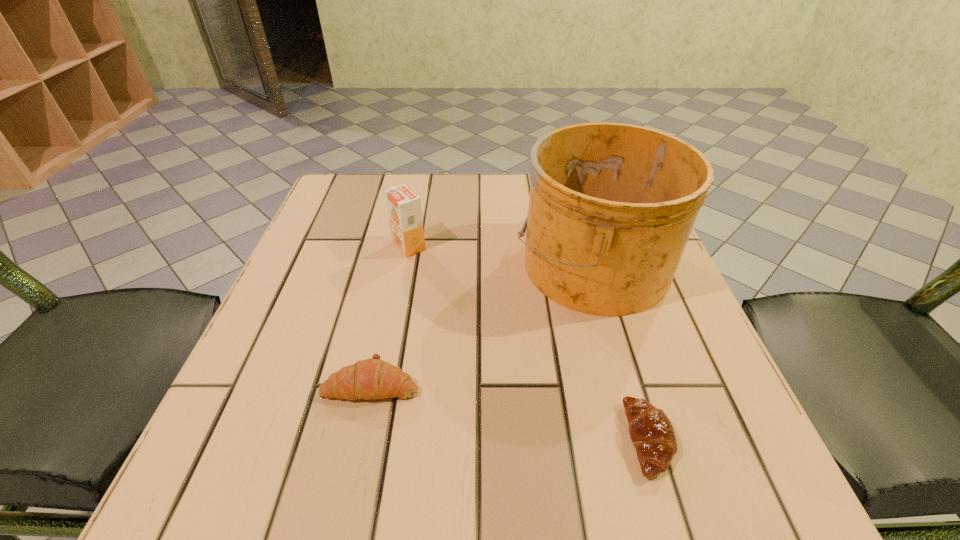
This screenshot has width=960, height=540. What are the coordinates of `free space between the third shortest object and the right crescent roll` in the screenshot? It's located at (529, 343).

Select which object is the third closest to the tallest object. Please provide its 2D coordinates. Your answer should be formatted as a tuple, i.e. [(x, y)], where the tuple contains the x and y coordinates of a point satisfying the conditions above.

[(373, 378)]

This screenshot has height=540, width=960. Identify the location of object that is the third closest to the left crescent roll. (651, 432).

Identify the location of free space in the image that satisfies the following two spatial constraints: 1. on the front side of the tallest object; 2. on the right side of the right crescent roll. Image resolution: width=960 pixels, height=540 pixels. 643,440.

This screenshot has width=960, height=540. In order to click on vacant space that satisfies the following two spatial constraints: 1. on the back side of the left crescent roll; 2. on the right side of the tallest object in this screenshot , I will do `click(397, 264)`.

Find the location of a particular element. The height and width of the screenshot is (540, 960). free location that satisfies the following two spatial constraints: 1. on the back side of the bucket; 2. on the left side of the left crescent roll is located at coordinates (397, 264).

This screenshot has width=960, height=540. I want to click on blank space that satisfies the following two spatial constraints: 1. on the front side of the orange juice; 2. on the left side of the right crescent roll, so click(372, 440).